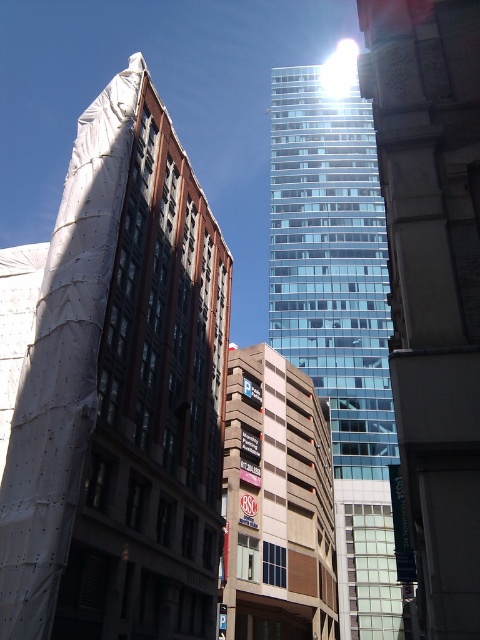
Can you confirm if white plastic building at left is wider than transparent glass building at center?

No, white plastic building at left is not wider than transparent glass building at center.

Does white plastic building at left have a larger size compared to transparent glass building at center?

No, white plastic building at left is not bigger than transparent glass building at center.

You are a GUI agent. You are given a task and a screenshot of the screen. Output one action in this format:
    pyautogui.click(x=<x>, y=<y>)
    Task: Click on the white plastic building at left
    Image resolution: width=480 pixels, height=640 pixels.
    Given the screenshot: What is the action you would take?
    pyautogui.click(x=120, y=394)

Where is `white plastic building at left`? This screenshot has width=480, height=640. white plastic building at left is located at coordinates (120, 394).

Does point (433, 442) come farther from viewer compared to point (303, 67)?

No, it is in front of (303, 67).

Is transparent glass tower at center taller than transparent glass building at center?

No.

Between point (403, 310) and point (372, 397), which one is positioned behind?

Point (372, 397)

Locate an element on the screen. The width and height of the screenshot is (480, 640). transparent glass tower at center is located at coordinates (432, 282).

Between transparent glass tower at center and brown brick building at center, which one has more height?

brown brick building at center

Can you confirm if transparent glass tower at center is positioned above brown brick building at center?

Correct, transparent glass tower at center is located above brown brick building at center.

Who is more forward, (x=432, y=256) or (x=236, y=424)?

Point (x=432, y=256)

This screenshot has width=480, height=640. What are the coordinates of `transparent glass tower at center` in the screenshot? It's located at (432, 282).